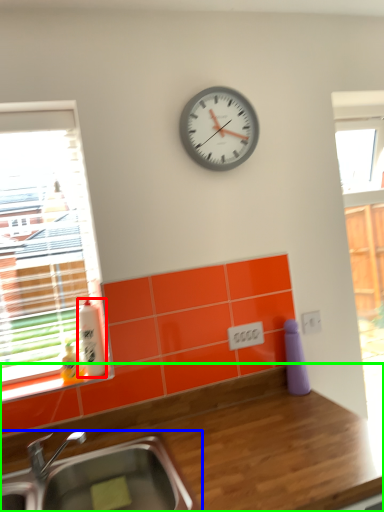
Question: Which is farther away from bottle (highlighted by a red box)? sink (highlighted by a blue box) or countertop (highlighted by a green box)?

Choices:
 (A) sink
 (B) countertop

Answer: (B)